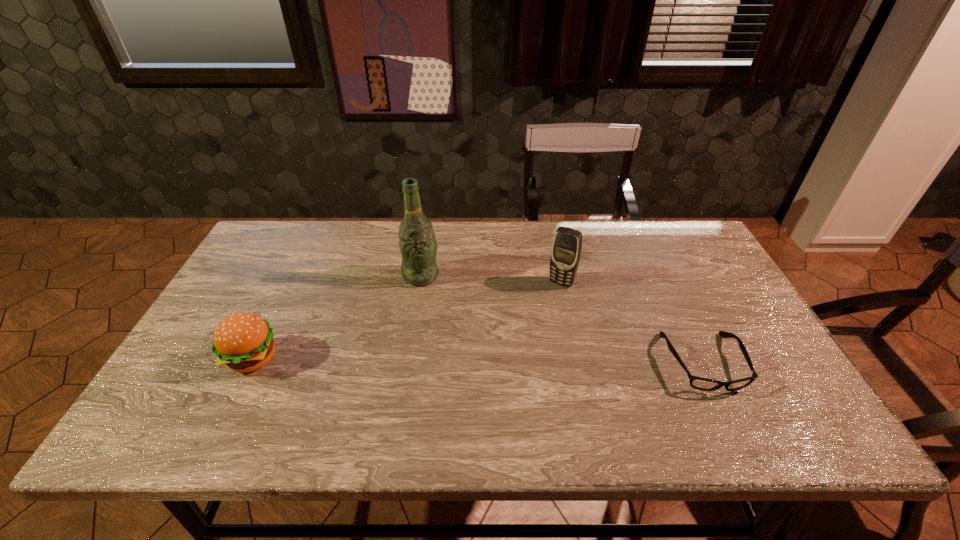
Locate an element on the screen. This screenshot has width=960, height=540. object located in the near left corner section of the desktop is located at coordinates (243, 341).

Locate an element on the screen. object located at the near right corner is located at coordinates (699, 383).

Identify the location of free space at the far edge of the desktop. This screenshot has height=540, width=960. [326, 250].

In the image, there is a desktop. Where is `free space at the near edge`? The image size is (960, 540). free space at the near edge is located at coordinates (664, 397).

The height and width of the screenshot is (540, 960). I want to click on free region at the left edge of the desktop, so click(x=269, y=271).

In the image, there is a desktop. Where is `vacant area at the right edge`? Image resolution: width=960 pixels, height=540 pixels. vacant area at the right edge is located at coordinates (739, 350).

Where is `free spot between the third tallest object and the second object from right to left`? free spot between the third tallest object and the second object from right to left is located at coordinates (407, 321).

The height and width of the screenshot is (540, 960). In order to click on vacant area that lies between the second tallest object and the leftmost object in this screenshot , I will do `click(407, 321)`.

Locate an element on the screen. The width and height of the screenshot is (960, 540). empty space between the third tallest object and the beer bottle is located at coordinates (336, 317).

The width and height of the screenshot is (960, 540). Find the location of `free space between the spectacles and the leftmost object`. free space between the spectacles and the leftmost object is located at coordinates (477, 361).